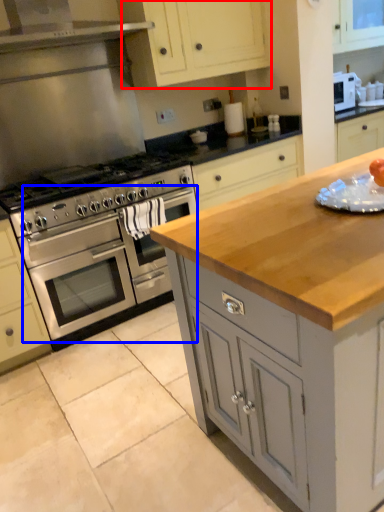
Question: Which object is further to the camera taking this photo, cabinetry (highlighted by a red box) or oven (highlighted by a blue box)?

Choices:
 (A) cabinetry
 (B) oven

Answer: (A)